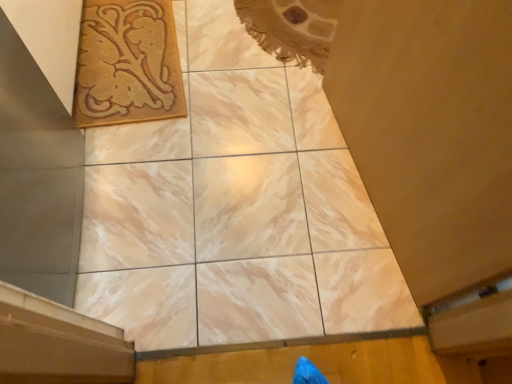
Locate an element on the screen. This screenshot has width=512, height=384. vacant area situated below beige woven rug at upper left (from a real-world perspective) is located at coordinates (136, 58).